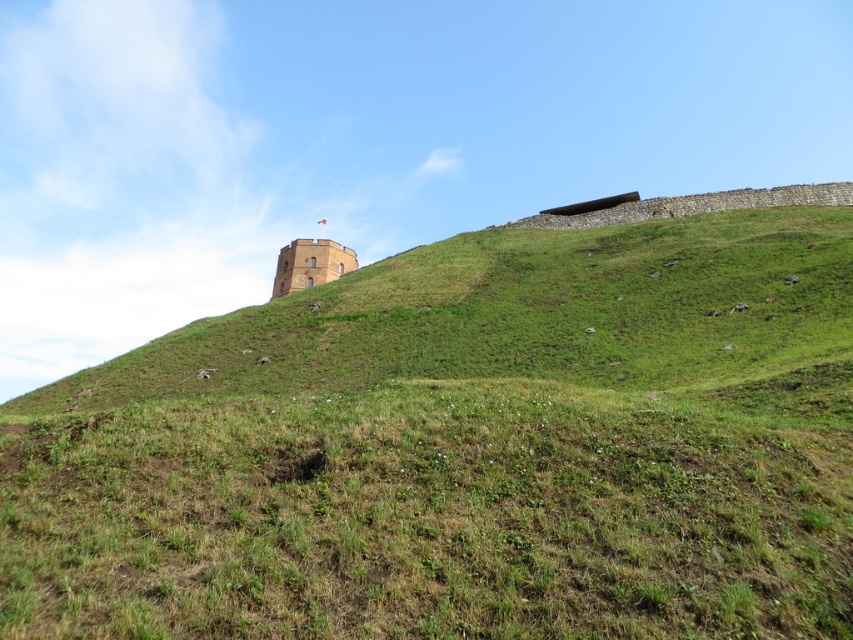
Question: Is green grassy hill at upper center smaller than stone tower at upper center?

Choices:
 (A) yes
 (B) no

Answer: (B)

Question: Which point appears farthest from the camera in this image?

Choices:
 (A) (711, 280)
 (B) (341, 253)

Answer: (B)

Question: Can you confirm if green grassy hill at upper center is thinner than stone tower at upper center?

Choices:
 (A) no
 (B) yes

Answer: (A)

Question: Is green grassy hill at upper center wider than stone tower at upper center?

Choices:
 (A) yes
 (B) no

Answer: (A)

Question: Among these points, which one is nearest to the camera?

Choices:
 (A) (326, 273)
 (B) (13, 541)

Answer: (B)